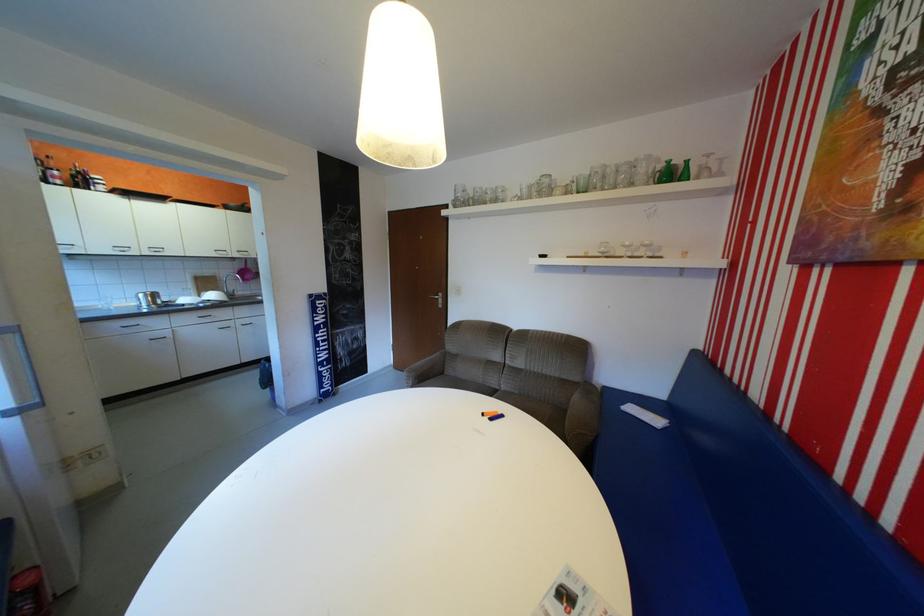
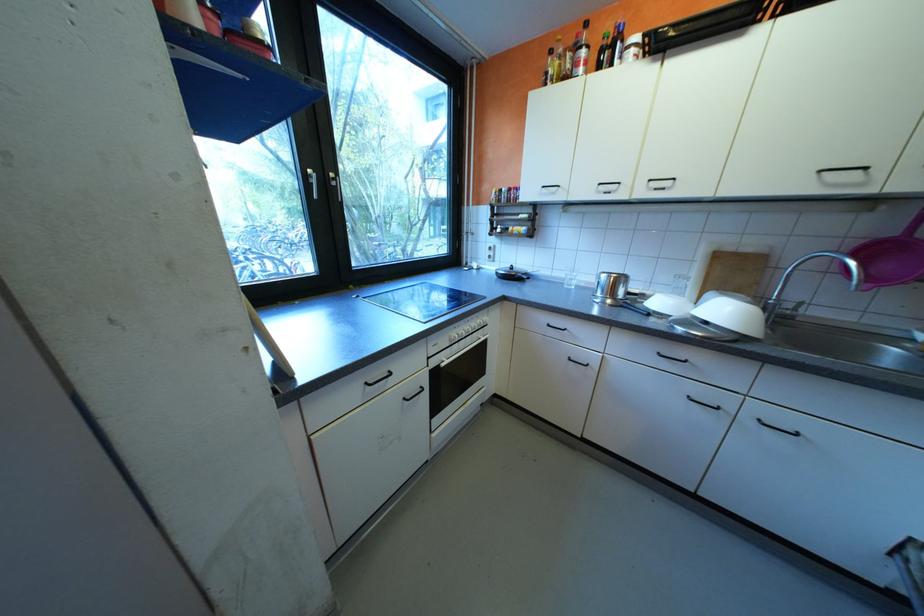
Find the pixel in the second image that matches point 225,294 in the first image.

(736, 312)